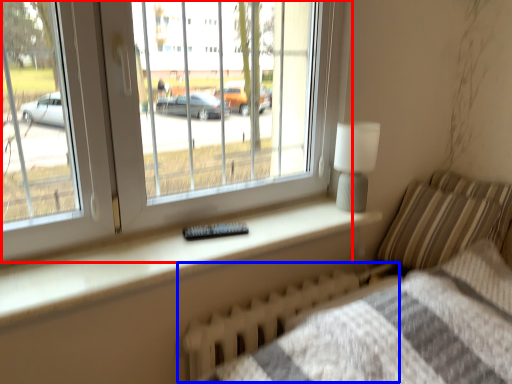
Question: Which object is closer to the camera taking this photo, window (highlighted by a red box) or radiator (highlighted by a blue box)?

Choices:
 (A) window
 (B) radiator

Answer: (A)